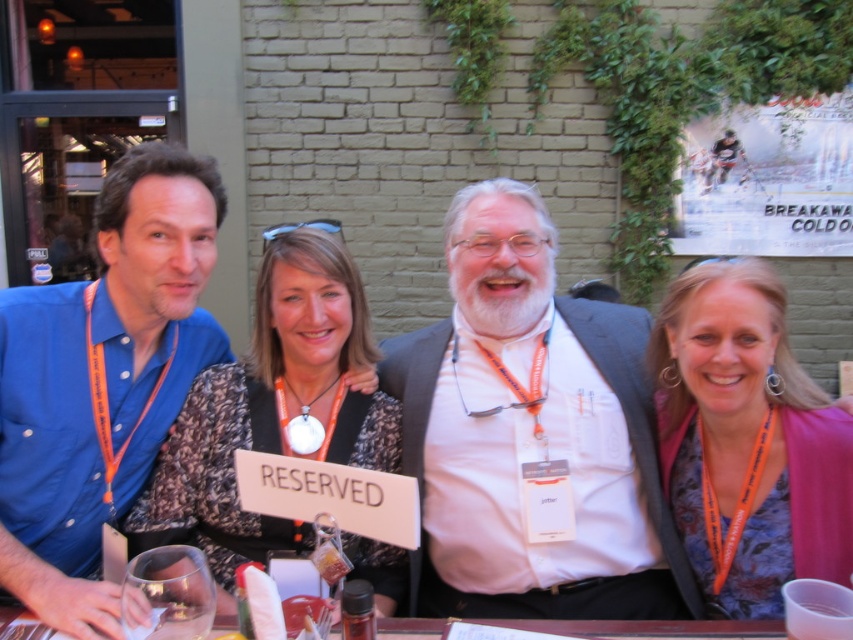
You are standing at the entrance of the restaurant and want to find the table where the blue cotton shirt at left is located. According to the coordinates provided, where should you look?

The blue cotton shirt at left is located at point (102, 380), so you should look towards the lower right section of the image to find the table.

Consider the image. You are a photographer trying to frame a group photo of the white matte suit at center and the speckled fabric dress at center. Which of the two requires a wider frame to capture the full width of the clothing?

The white matte suit at center requires a wider frame because its width is larger than that of the speckled fabric dress at center.

Based on the scene description, where is the white matte suit at center located in terms of its 2D coordinates?

The white matte suit at center is located at the 2D coordinates point (531,433).